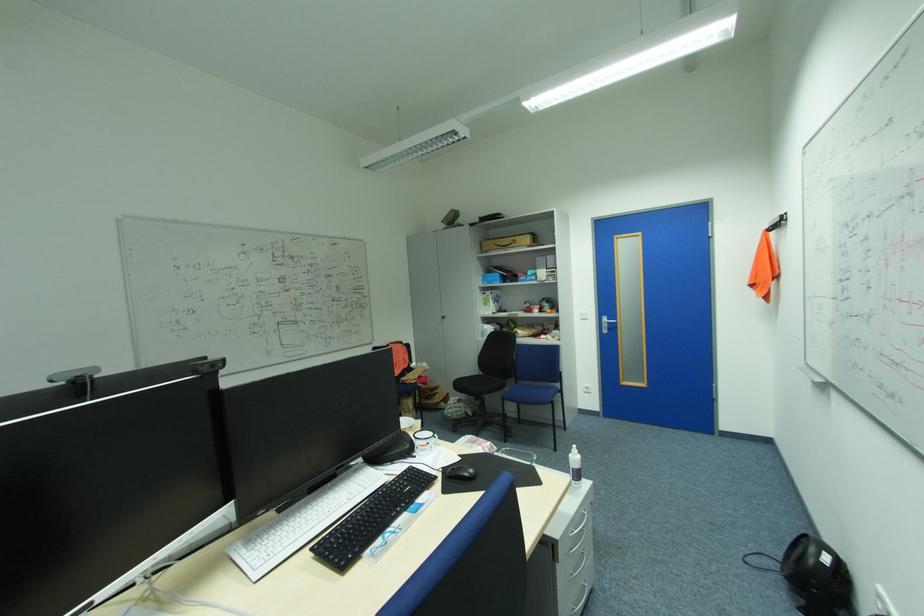
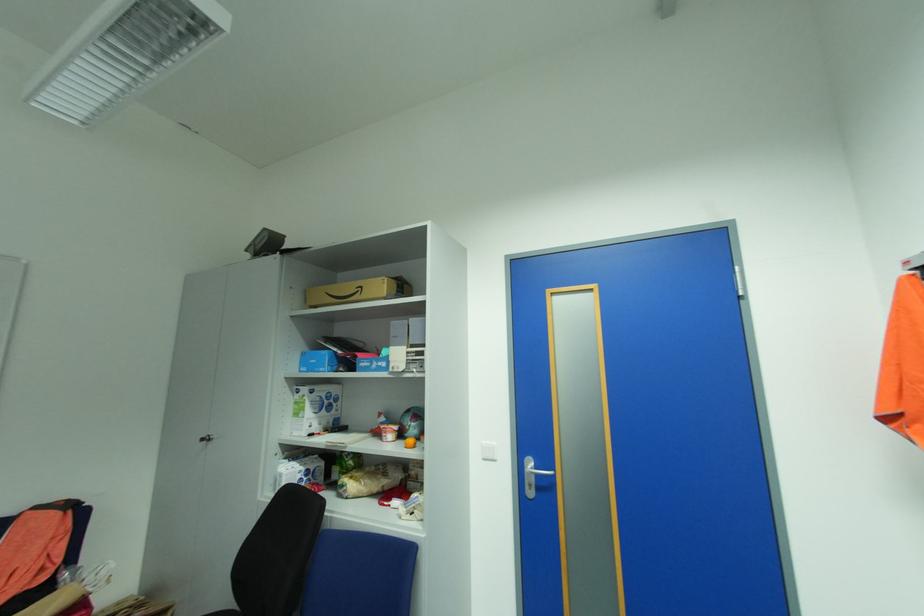
Find the pixel in the second image that matches pixel 589 320 in the first image.

(492, 460)